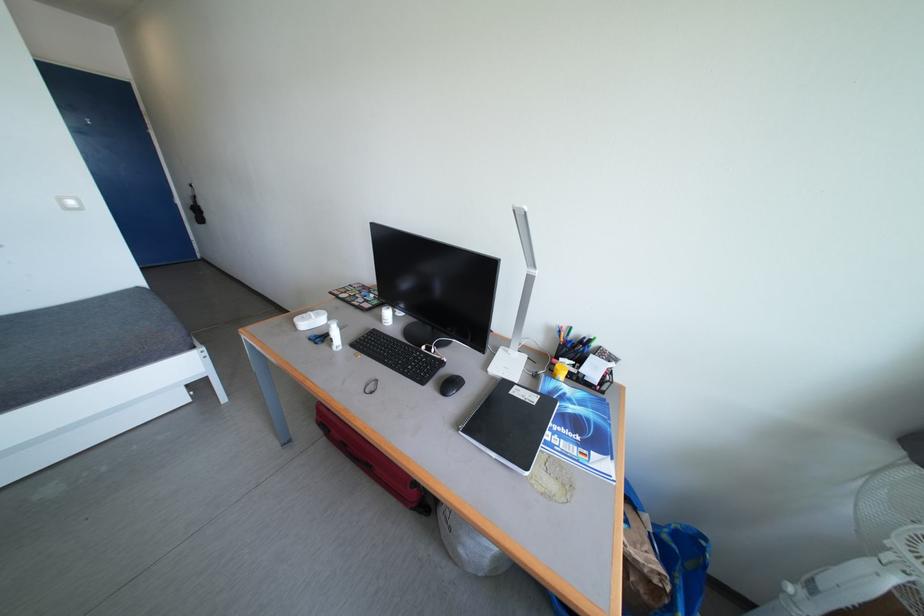
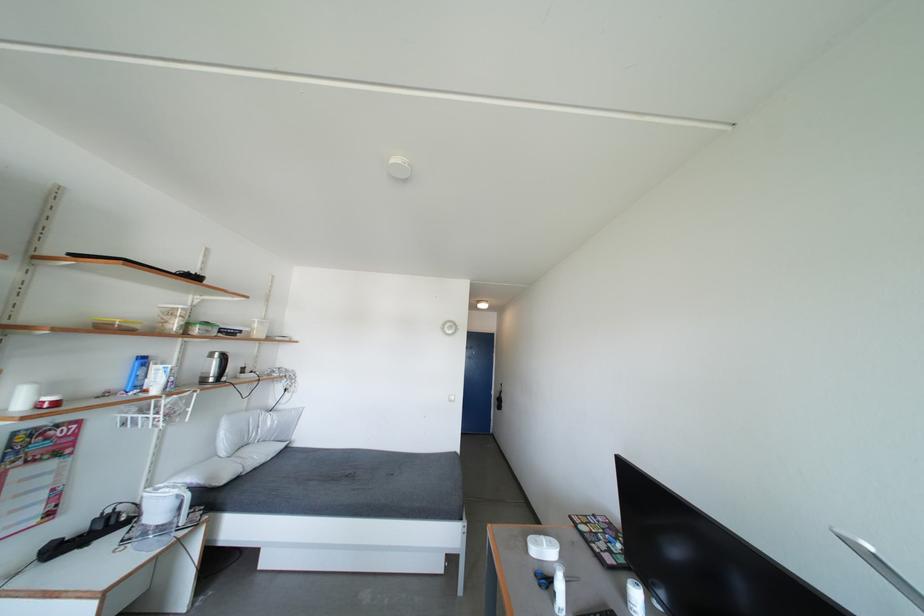
Where in the second image is the point corresponding to point 329,342 from the first image?

(553, 588)